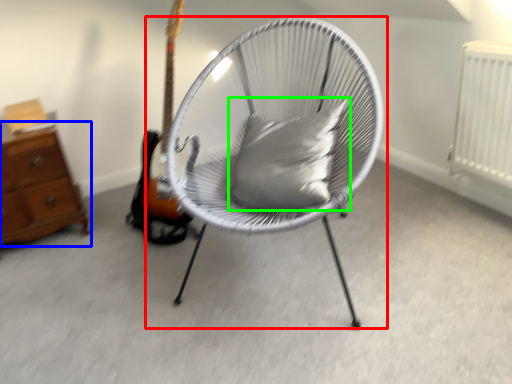
Question: Which object is positioned closest to chair (highlighted by a red box)? Select from chest of drawers (highlighted by a blue box) and pillow (highlighted by a green box).

Choices:
 (A) chest of drawers
 (B) pillow

Answer: (B)